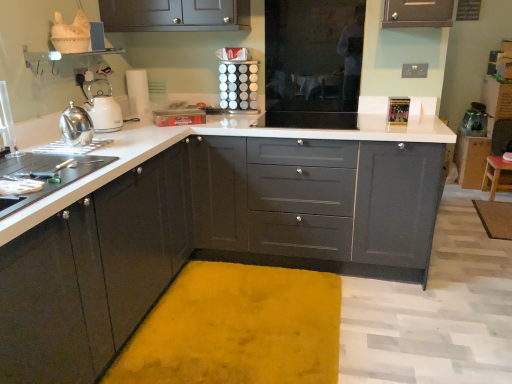
Identify the location of free spot above yellow plush bath mat at center, the 2th bath mat positioned from the top (from a real-world perspective). The image size is (512, 384). (237, 331).